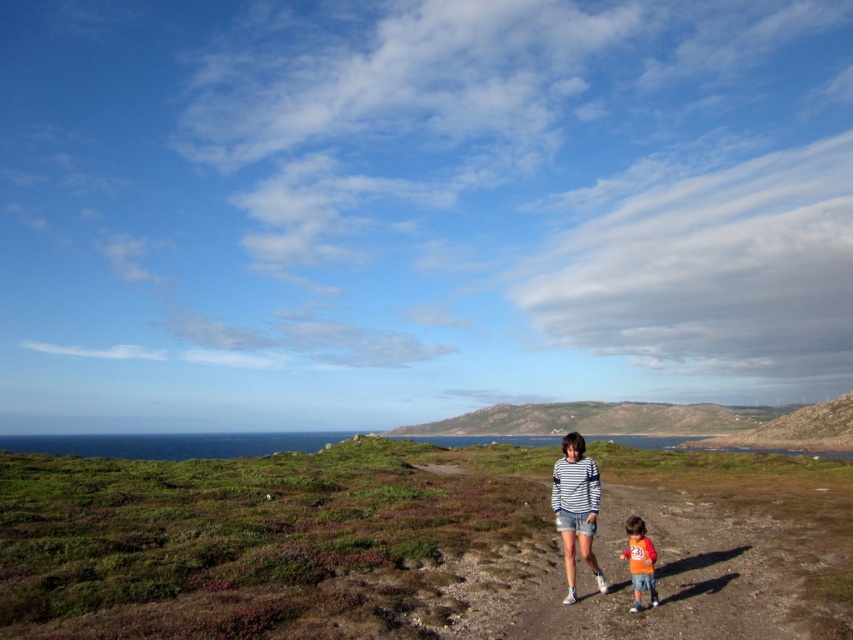
Question: Which is nearer to the striped shirt at center?

Choices:
 (A) brown dirt path at center
 (B) orange cotton shirt at lower center

Answer: (B)

Question: Does striped shirt at center appear over orange cotton shirt at lower center?

Choices:
 (A) yes
 (B) no

Answer: (A)

Question: Among these objects, which one is farthest from the camera?

Choices:
 (A) orange cotton shirt at lower center
 (B) striped shirt at center

Answer: (B)

Question: Does striped shirt at center lie in front of orange cotton shirt at lower center?

Choices:
 (A) no
 (B) yes

Answer: (A)

Question: Based on their relative distances, which object is farther from the orange cotton shirt at lower center?

Choices:
 (A) striped shirt at center
 (B) brown dirt path at center

Answer: (B)

Question: Is brown dirt path at center further to camera compared to orange cotton shirt at lower center?

Choices:
 (A) no
 (B) yes

Answer: (A)